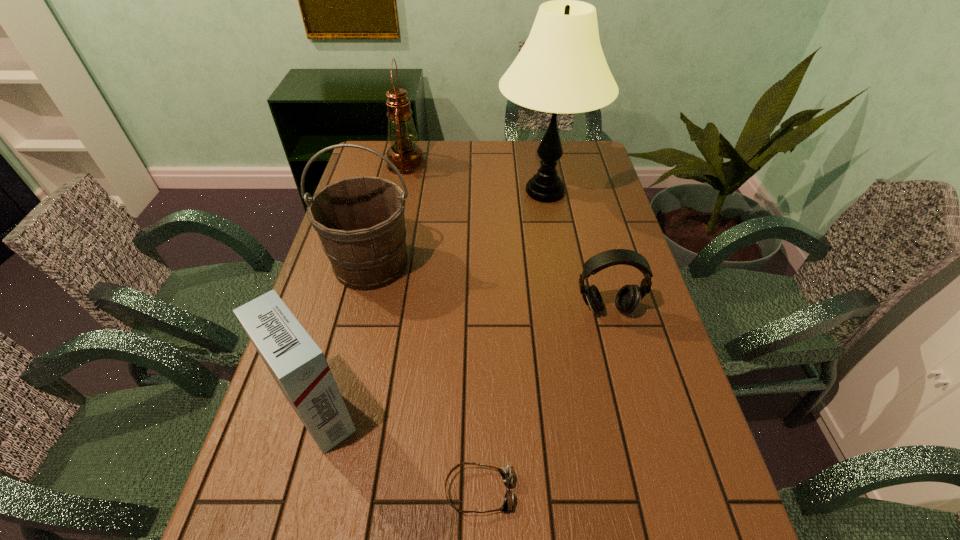
At what (x,y) coordinates should I click in order to perform the action: click on vacant area between the goggles and the bucket. Please return your answer as a coordinate pair (x, y). The height and width of the screenshot is (540, 960). Looking at the image, I should click on (425, 377).

Find the location of a particular element. vacant area between the fourth tallest object and the fourth farthest object is located at coordinates (462, 360).

Image resolution: width=960 pixels, height=540 pixels. I want to click on vacant region between the earphone and the third farthest object, so click(489, 287).

At what (x,y) coordinates should I click in order to perform the action: click on vacant space that's between the tallest object and the nearest object. Please return your answer as a coordinate pair (x, y). This screenshot has height=540, width=960. Looking at the image, I should click on (512, 341).

Locate an element on the screen. The width and height of the screenshot is (960, 540). vacant region between the second nearest object and the earphone is located at coordinates (462, 360).

You are a GUI agent. You are given a task and a screenshot of the screen. Output one action in this format:
    pyautogui.click(x=<x>, y=<y>)
    Task: Click on the vacant space in between the fifth tallest object and the oil lamp
    The width and height of the screenshot is (960, 540).
    Given the screenshot: What is the action you would take?
    coord(506,237)

Where is `blank region between the third nearest object and the bucket`? blank region between the third nearest object and the bucket is located at coordinates (489, 287).

The width and height of the screenshot is (960, 540). I want to click on free space that is in between the cigarette case and the fourth farthest object, so click(462, 360).

Where is `the closest object relative to the earphone`? This screenshot has height=540, width=960. the closest object relative to the earphone is located at coordinates (561, 68).

Identify the location of object that stands as the second closest to the oil lamp. This screenshot has width=960, height=540. (360, 221).